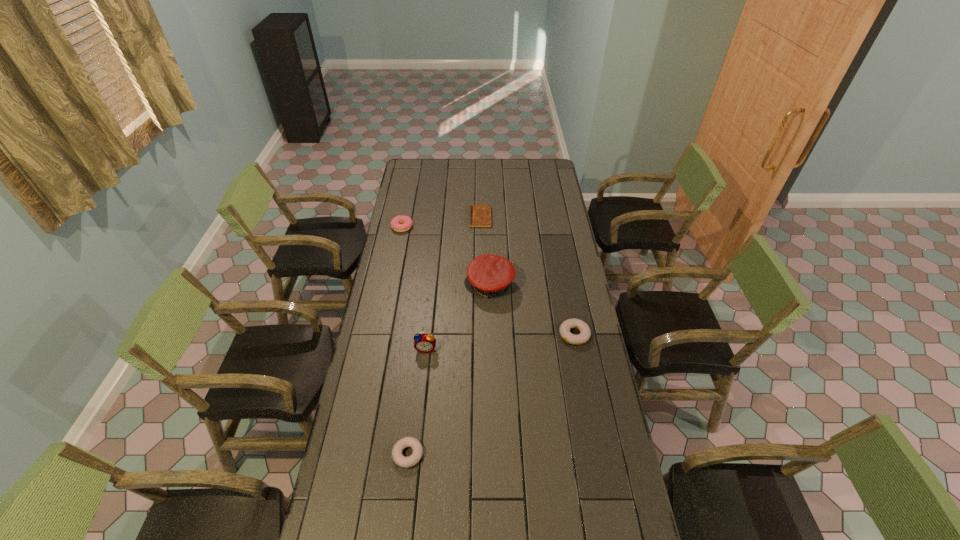
The image size is (960, 540). In order to click on the nearest object in this screenshot , I will do `click(402, 461)`.

Identify the location of the second doughnut from left to right. Image resolution: width=960 pixels, height=540 pixels. (402, 461).

This screenshot has height=540, width=960. I want to click on the rightmost object, so click(x=585, y=333).

Where is `the rightmost doughnut`? Image resolution: width=960 pixels, height=540 pixels. the rightmost doughnut is located at coordinates (585, 333).

The image size is (960, 540). I want to click on the leftmost object, so click(x=396, y=225).

You are a GUI agent. You are given a task and a screenshot of the screen. Output one action in this format:
    pyautogui.click(x=<x>, y=<y>)
    Task: Click on the leftmost doughnut
    
    Given the screenshot: What is the action you would take?
    pyautogui.click(x=396, y=225)

Locate an element on the screen. alarm clock is located at coordinates (424, 343).

Where is `the shortest object`? This screenshot has height=540, width=960. the shortest object is located at coordinates (479, 215).

This screenshot has height=540, width=960. Find the location of `cap`. cap is located at coordinates (489, 275).

This screenshot has height=540, width=960. In order to click on blank area located on the back of the nearest object in this screenshot , I will do `click(416, 387)`.